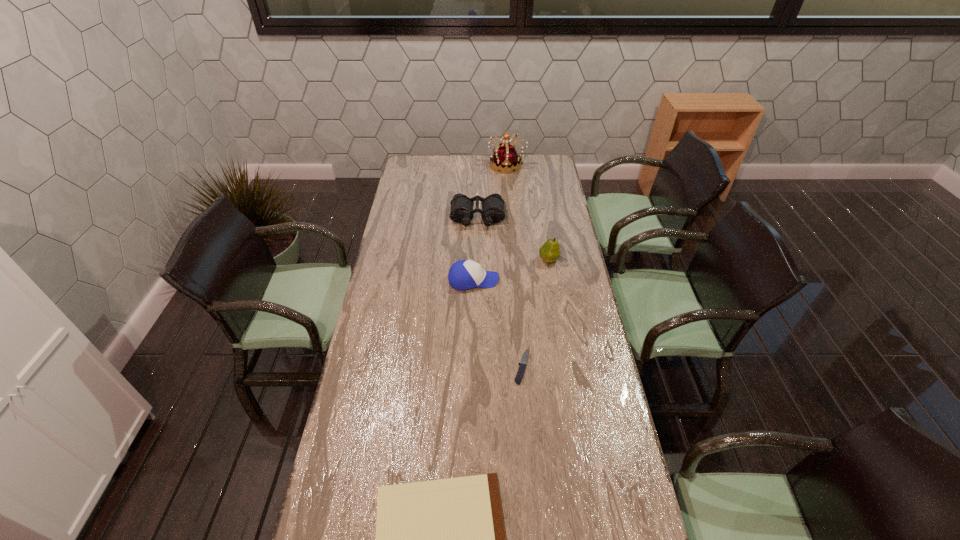
Locate an element on the screen. vacant area at the far right corner is located at coordinates (538, 159).

At what (x,y) coordinates should I click in order to perform the action: click on vacant space that's between the third farthest object and the baseball cap. Please return your answer as a coordinate pair (x, y). Looking at the image, I should click on (511, 270).

Locate an element on the screen. free area in between the binoculars and the steak knife is located at coordinates (500, 292).

Locate an element on the screen. vacant point located between the binoculars and the baseball cap is located at coordinates (475, 248).

Identify the location of empty location between the binoculars and the tiara. The image size is (960, 540). (492, 191).

Locate an element on the screen. Image resolution: width=960 pixels, height=540 pixels. free space between the fifth nearest object and the pear is located at coordinates click(514, 239).

In order to click on the fourth closest object to the pear in this screenshot , I will do 506,159.

Locate an element on the screen. the third closest object to the second tallest object is located at coordinates (520, 373).

The height and width of the screenshot is (540, 960). I want to click on vacant space that satisfies the following two spatial constraints: 1. on the front-facing side of the farthest object; 2. on the right side of the pear, so click(x=516, y=260).

This screenshot has width=960, height=540. Identify the location of vacant area in the image that satisfies the following two spatial constraints: 1. on the front-facing side of the tallest object; 2. through the eyepieces of the fifth nearest object. (512, 217).